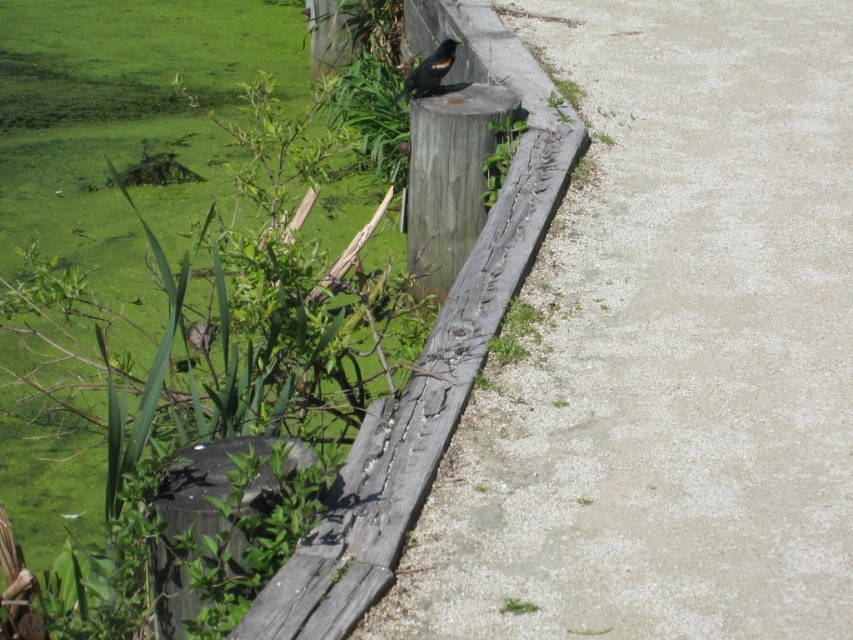
Who is higher up, weathered wood curb at center or shiny black bird at upper center?

shiny black bird at upper center is higher up.

Based on the photo, who is shorter, weathered wood curb at center or shiny black bird at upper center?

shiny black bird at upper center is shorter.

Locate an element on the screen. This screenshot has width=853, height=640. weathered wood curb at center is located at coordinates (427, 353).

Between point (817, 492) and point (381, 540), which one is positioned behind?

Positioned behind is point (817, 492).

Who is lower down, gray concrete sidewalk at center or weathered wood curb at center?

Positioned lower is gray concrete sidewalk at center.

Which is behind, point (624, 173) or point (360, 504)?

Positioned behind is point (624, 173).

What are the coordinates of `gray concrete sidewalk at center` in the screenshot? It's located at (666, 349).

Does point (811, 129) come behind point (425, 90)?

That is True.

Is gray concrete sidewalk at center to the left of shiny black bird at upper center from the viewer's perspective?

No, gray concrete sidewalk at center is not to the left of shiny black bird at upper center.

Where is `gray concrete sidewalk at center`? gray concrete sidewalk at center is located at coordinates (666, 349).

Identify the location of gray concrete sidewalk at center. (666, 349).